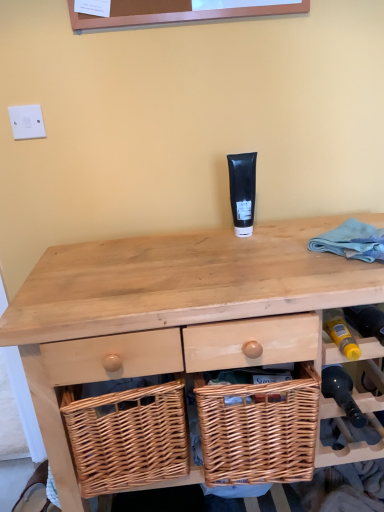
Question: Is black matte tube at center at the right side of natural wood desk at center?

Choices:
 (A) yes
 (B) no

Answer: (B)

Question: Are black matte tube at center and natural wood desk at center located far from each other?

Choices:
 (A) yes
 (B) no

Answer: (B)

Question: Could you tell me if black matte tube at center is turned towards natural wood desk at center?

Choices:
 (A) no
 (B) yes

Answer: (A)

Question: Does black matte tube at center have a larger size compared to natural wood desk at center?

Choices:
 (A) yes
 (B) no

Answer: (B)

Question: From a real-world perspective, is black matte tube at center positioned over natural wood desk at center based on gravity?

Choices:
 (A) yes
 (B) no

Answer: (A)

Question: Considering the relative positions of black matte tube at center and natural wood desk at center in the image provided, is black matte tube at center behind natural wood desk at center?

Choices:
 (A) no
 (B) yes

Answer: (B)

Question: Considering the relative positions of natural wood desk at center and woven wood basket at lower center in the image provided, is natural wood desk at center in front of woven wood basket at lower center?

Choices:
 (A) yes
 (B) no

Answer: (A)

Question: Considering the relative positions of natural wood desk at center and woven wood basket at lower center in the image provided, is natural wood desk at center behind woven wood basket at lower center?

Choices:
 (A) no
 (B) yes

Answer: (A)

Question: From the image's perspective, does natural wood desk at center appear lower than woven wood basket at lower center?

Choices:
 (A) yes
 (B) no

Answer: (A)

Question: Is natural wood desk at center next to woven wood basket at lower center?

Choices:
 (A) no
 (B) yes

Answer: (A)

Question: From a real-world perspective, is natural wood desk at center on top of woven wood basket at lower center?

Choices:
 (A) yes
 (B) no

Answer: (B)

Question: Does natural wood desk at center have a greater width compared to woven wood basket at lower center?

Choices:
 (A) yes
 (B) no

Answer: (A)

Question: Is black matte tube at center to the left of white plastic switch at upper left from the viewer's perspective?

Choices:
 (A) yes
 (B) no

Answer: (B)